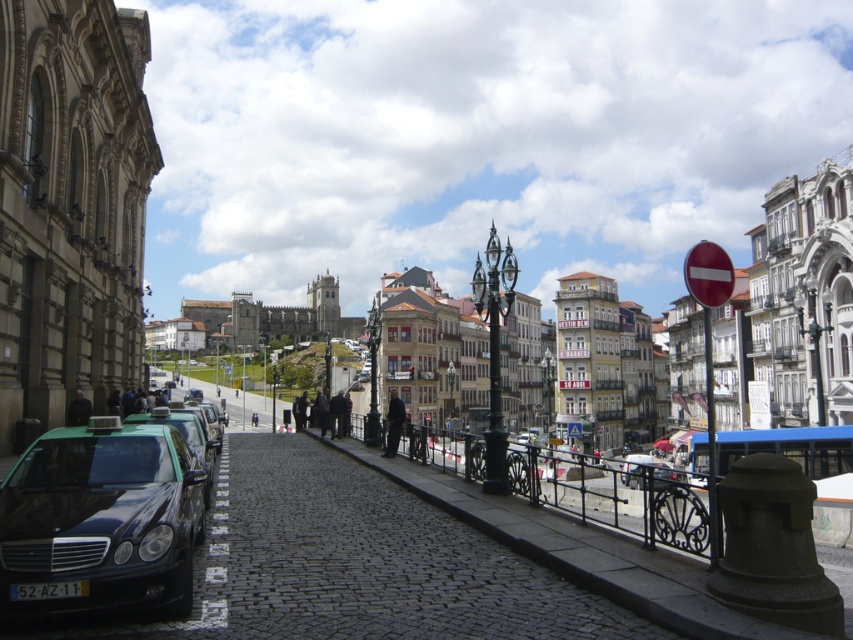
Which is more to the left, green matte taxi at lower left or dark gray suit at center?

Positioned to the left is green matte taxi at lower left.

Who is positioned more to the right, green matte taxi at lower left or dark gray suit at center?

dark gray suit at center

Between point (112, 518) and point (387, 452), which one is positioned behind?

Positioned behind is point (387, 452).

Find the location of a particular element. Image resolution: width=853 pixels, height=640 pixels. green matte taxi at lower left is located at coordinates (102, 518).

Between point (73, 424) and point (254, 417), which one is positioned in front?

Point (73, 424) is in front.

Looking at this image, is dark gray fabric jacket at lower left smaller than dark blue jeans at center?

Correct, dark gray fabric jacket at lower left occupies less space than dark blue jeans at center.

At what (x,y) coordinates should I click in order to perform the action: click on dark gray fabric jacket at lower left. Please return your answer as a coordinate pair (x, y). Image resolution: width=853 pixels, height=640 pixels. Looking at the image, I should click on (78, 410).

The width and height of the screenshot is (853, 640). I want to click on dark gray fabric jacket at lower left, so click(78, 410).

Is point (389, 426) less distant than point (79, 394)?

No, it is not.

Does dark gray suit at center have a smaller size compared to dark gray fabric jacket at lower left?

No, dark gray suit at center is not smaller than dark gray fabric jacket at lower left.

Who is more forward, (389, 396) or (86, 413)?

Point (86, 413) is more forward.

At what (x,y) coordinates should I click in order to perform the action: click on dark gray suit at center. Please return your answer as a coordinate pair (x, y). The image size is (853, 640). Looking at the image, I should click on (393, 422).